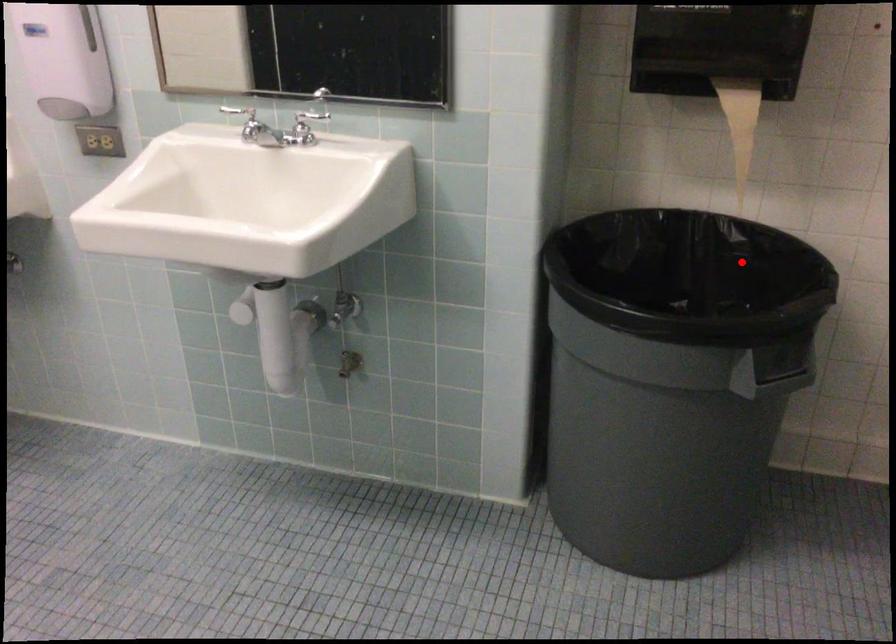
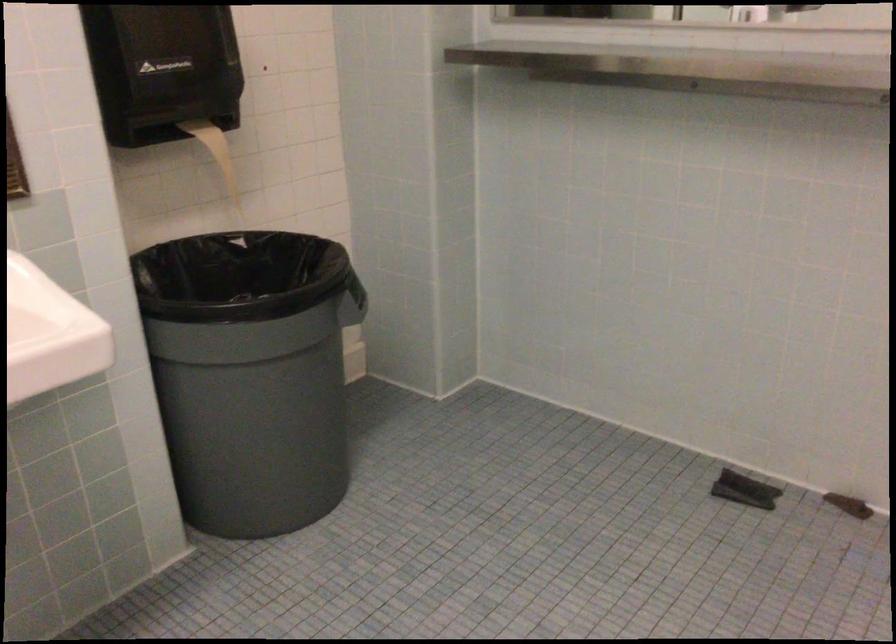
Question: A red point is marked in image1. In image2, is the corresponding 3D point closer to the camera or farther? Reply with the corresponding letter.

Choices:
 (A) The corresponding 3D point is closer.
 (B) The corresponding 3D point is farther.

Answer: (B)